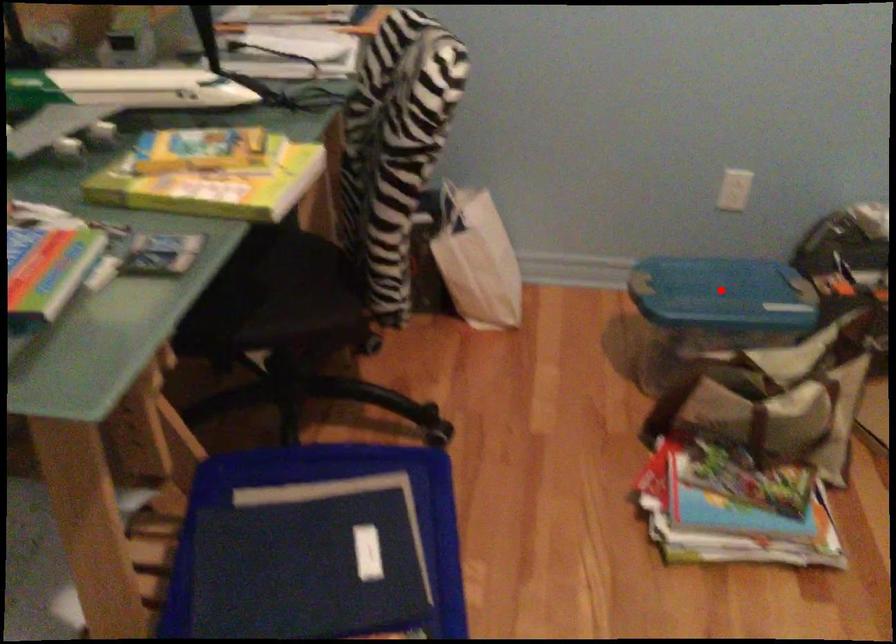
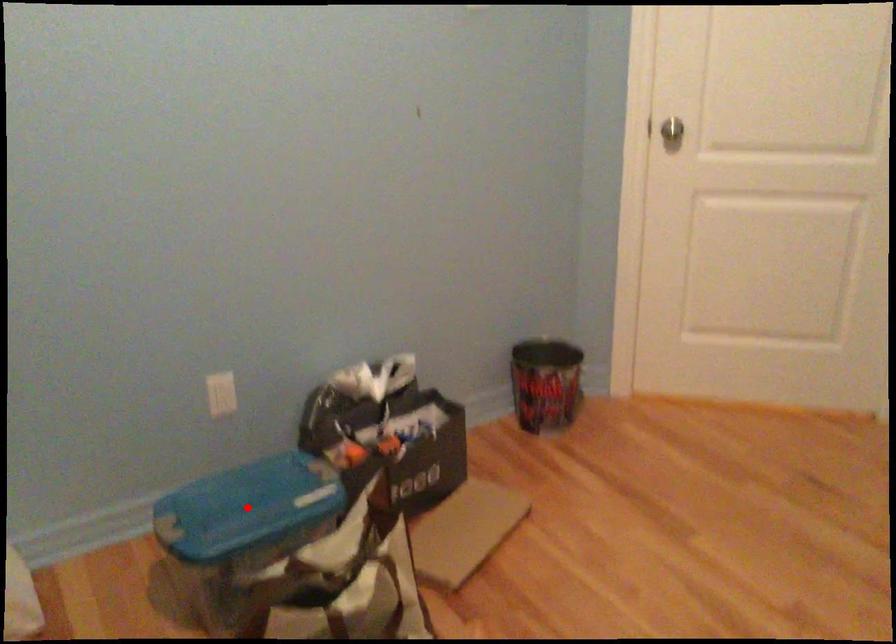
I am providing you with two images of the same scene from different viewpoints. A red point is marked on the first image and another point is marked on the second image. Is the marked point in image1 the same physical position as the marked point in image2?

Yes